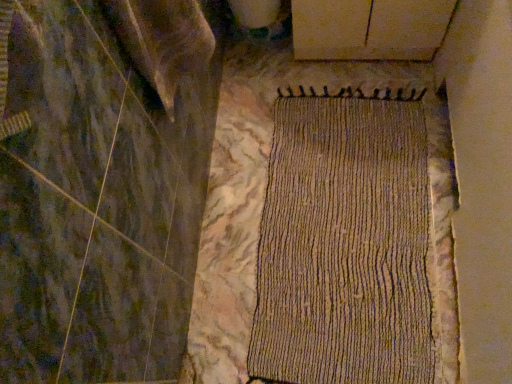
What do you see at coordinates (345, 244) in the screenshot? I see `woven beige mat at center` at bounding box center [345, 244].

You are a GUI agent. You are given a task and a screenshot of the screen. Output one action in this format:
    pyautogui.click(x=<x>, y=<y>)
    Task: Click on the woven beige mat at center
    
    Given the screenshot: What is the action you would take?
    pyautogui.click(x=345, y=244)

What do you see at coordinates (369, 29) in the screenshot? I see `smooth white plywood at upper center` at bounding box center [369, 29].

The width and height of the screenshot is (512, 384). Identify the location of smooth white plywood at upper center. (369, 29).

What is the approximate width of smooth white plywood at upper center?

10.72 inches.

You are a GUI agent. You are given a task and a screenshot of the screen. Output one action in this format:
    pyautogui.click(x=<x>, y=<y>)
    Task: Click on the woven beige mat at center
    The image size is (512, 384).
    Given the screenshot: What is the action you would take?
    pyautogui.click(x=345, y=244)

Which is more to the left, smooth white plywood at upper center or woven beige mat at center?

Positioned to the left is woven beige mat at center.

Is the position of smooth white plywood at upper center less distant than that of woven beige mat at center?

That is False.

Does point (315, 20) come behind point (389, 237)?

Yes, point (315, 20) is behind point (389, 237).

From the image's perspective, which one is positioned lower, smooth white plywood at upper center or woven beige mat at center?

woven beige mat at center, from the image's perspective.

From a real-world perspective, between smooth white plywood at upper center and woven beige mat at center, who is vertically lower?

In real-world perspective, woven beige mat at center is lower.

Which of these two, smooth white plywood at upper center or woven beige mat at center, is wider?

Wider between the two is woven beige mat at center.

Between smooth white plywood at upper center and woven beige mat at center, which one has less height?

Standing shorter between the two is woven beige mat at center.

Considering the relative sizes of smooth white plywood at upper center and woven beige mat at center in the image provided, is smooth white plywood at upper center bigger than woven beige mat at center?

Yes.

Does smooth white plywood at upper center contain woven beige mat at center?

No, woven beige mat at center is located outside of smooth white plywood at upper center.

Are smooth white plywood at upper center and woven beige mat at center far apart?

They are positioned close to each other.

From the picture: Is smooth white plywood at upper center looking in the opposite direction of woven beige mat at center?

That's not correct — smooth white plywood at upper center is not looking away from woven beige mat at center.

Find the location of a particular element. This screenshot has width=512, height=384. mat lying below the smooth white plywood at upper center (from the image's perspective) is located at coordinates (345, 244).

Does woven beige mat at center appear on the left side of smooth white plywood at upper center?

Yes, woven beige mat at center is to the left of smooth white plywood at upper center.

In the image, is woven beige mat at center positioned in front of or behind smooth white plywood at upper center?

woven beige mat at center is positioned closer to the viewer than smooth white plywood at upper center.

Does point (303, 358) lie behind point (376, 3)?

No, it is not.

Based on the photo, from the image's perspective, is woven beige mat at center located above or below smooth white plywood at upper center?

Clearly, from the image's perspective, woven beige mat at center is below smooth white plywood at upper center.

From a real-world perspective, is woven beige mat at center on smooth white plywood at upper center?

No, from a real-world perspective, woven beige mat at center is not over smooth white plywood at upper center

Which of these two, woven beige mat at center or smooth white plywood at upper center, is thinner?

With smaller width is smooth white plywood at upper center.

Can you confirm if woven beige mat at center is taller than smooth white plywood at upper center?

Incorrect, the height of woven beige mat at center is not larger of that of smooth white plywood at upper center.

Who is smaller, woven beige mat at center or smooth white plywood at upper center?

Smaller between the two is woven beige mat at center.

Is woven beige mat at center outside of smooth white plywood at upper center?

Yes, woven beige mat at center is outside of smooth white plywood at upper center.

Is woven beige mat at center far away from smooth white plywood at upper center?

That's not correct — woven beige mat at center is a little close to smooth white plywood at upper center.

Is woven beige mat at center looking in the opposite direction of smooth white plywood at upper center?

woven beige mat at center does not have its back to smooth white plywood at upper center.

In order to click on mat that appears below the smooth white plywood at upper center (from the image's perspective) in this screenshot , I will do `click(345, 244)`.

Identify the location of plywood that is above the woven beige mat at center (from a real-world perspective). (369, 29).

Locate an element on the screen. Image resolution: width=512 pixels, height=384 pixels. plywood above the woven beige mat at center (from the image's perspective) is located at coordinates (369, 29).